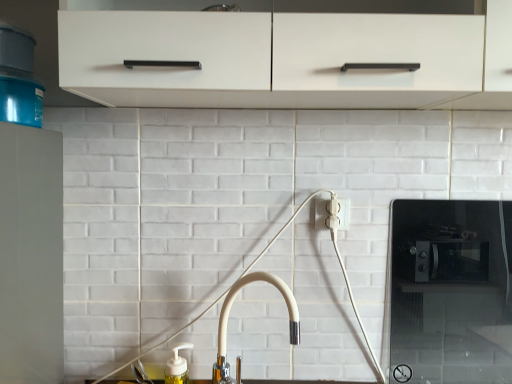
Image resolution: width=512 pixels, height=384 pixels. What do you see at coordinates (449, 292) in the screenshot? I see `black glass microwave at right` at bounding box center [449, 292].

Find the location of a particular element. The height and width of the screenshot is (384, 512). black glass microwave at right is located at coordinates tap(449, 292).

Where is `cream matte faucet at center`? cream matte faucet at center is located at coordinates (228, 317).

Describe the element at coordinates (228, 317) in the screenshot. The height and width of the screenshot is (384, 512). I see `cream matte faucet at center` at that location.

Where is `black glass microwave at right`? black glass microwave at right is located at coordinates (449, 292).

Does black glass microwave at right appear on the left side of cream matte faucet at center?

Incorrect, black glass microwave at right is not on the left side of cream matte faucet at center.

Is black glass microwave at right in front of or behind cream matte faucet at center in the image?

Visually, black glass microwave at right is located behind cream matte faucet at center.

Considering the positions of points (504, 250) and (223, 380), is point (504, 250) farther from camera compared to point (223, 380)?

That is True.

From the image's perspective, between black glass microwave at right and cream matte faucet at center, who is located below?

cream matte faucet at center appears lower in the image.

From a real-world perspective, who is located lower, black glass microwave at right or cream matte faucet at center?

cream matte faucet at center, from a real-world perspective.

Is black glass microwave at right thinner than cream matte faucet at center?

Indeed, black glass microwave at right has a lesser width compared to cream matte faucet at center.

Considering the relative sizes of black glass microwave at right and cream matte faucet at center in the image provided, is black glass microwave at right taller than cream matte faucet at center?

Yes.

Considering the sizes of objects black glass microwave at right and cream matte faucet at center in the image provided, who is bigger, black glass microwave at right or cream matte faucet at center?

Bigger between the two is cream matte faucet at center.

Could cream matte faucet at center be considered to be inside black glass microwave at right?

No, cream matte faucet at center is not inside black glass microwave at right.

Is black glass microwave at right directly adjacent to cream matte faucet at center?

black glass microwave at right and cream matte faucet at center are clearly separated.

Is black glass microwave at right turned away from cream matte faucet at center?

No, black glass microwave at right is not facing the opposite direction of cream matte faucet at center.

How many degrees apart are the facing directions of black glass microwave at right and cream matte faucet at center?

The angle between the facing direction of black glass microwave at right and the facing direction of cream matte faucet at center is 0.625 degrees.

Where is `appliance located above the cream matte faucet at center (from a real-world perspective)`? The width and height of the screenshot is (512, 384). appliance located above the cream matte faucet at center (from a real-world perspective) is located at coordinates (449, 292).

Does cream matte faucet at center appear on the left side of black glass microwave at right?

Indeed, cream matte faucet at center is positioned on the left side of black glass microwave at right.

Which object is closer to the camera, cream matte faucet at center or black glass microwave at right?

cream matte faucet at center is more forward.

Is point (297, 330) positioned after point (510, 336)?

That is False.

From the image's perspective, would you say cream matte faucet at center is shown under black glass microwave at right?

Yes, from the image's perspective, cream matte faucet at center is below black glass microwave at right.

From a real-world perspective, who is located higher, cream matte faucet at center or black glass microwave at right?

black glass microwave at right, from a real-world perspective.

Does cream matte faucet at center have a greater width compared to black glass microwave at right?

Yes, cream matte faucet at center is wider than black glass microwave at right.

Considering the sizes of objects cream matte faucet at center and black glass microwave at right in the image provided, who is shorter, cream matte faucet at center or black glass microwave at right?

Standing shorter between the two is cream matte faucet at center.

Based on their sizes in the image, would you say cream matte faucet at center is bigger or smaller than black glass microwave at right?

Considering their sizes, cream matte faucet at center takes up more space than black glass microwave at right.

Does cream matte faucet at center contain black glass microwave at right?

Actually, black glass microwave at right is outside cream matte faucet at center.

Based on the photo, are cream matte faucet at center and black glass microwave at right far apart?

That's not correct — cream matte faucet at center is a little close to black glass microwave at right.

Does cream matte faucet at center turn towards black glass microwave at right?

No.

How far apart are cream matte faucet at center and black glass microwave at right?

cream matte faucet at center and black glass microwave at right are 16.14 inches apart from each other.

This screenshot has width=512, height=384. In order to click on tap on the left of black glass microwave at right in this screenshot , I will do `click(228, 317)`.

Locate an element on the screen. Image resolution: width=512 pixels, height=384 pixels. tap in front of the black glass microwave at right is located at coordinates (228, 317).

This screenshot has width=512, height=384. Identify the location of tap lying below the black glass microwave at right (from the image's perspective). (228, 317).